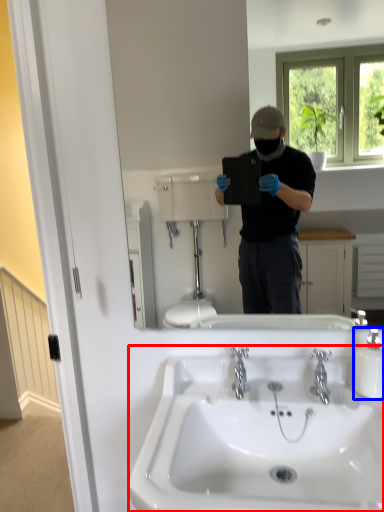
Question: Which point is further to the camera, sink (highlighted by a red box) or bottle (highlighted by a blue box)?

Choices:
 (A) sink
 (B) bottle

Answer: (B)